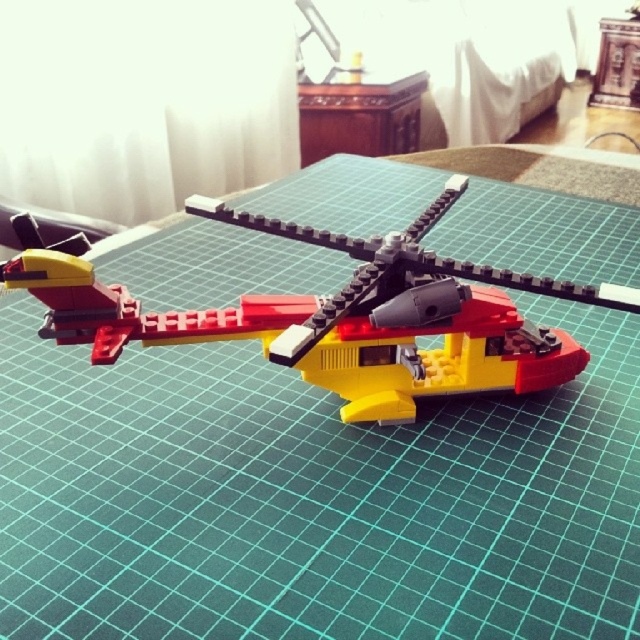
Is point (528, 321) positioned behind point (337, 138)?

No, it is in front of (337, 138).

What do you see at coordinates (337, 314) in the screenshot? I see `yellow plastic helicopter at center` at bounding box center [337, 314].

Which is in front, point (221, 332) or point (401, 113)?

Point (221, 332) is in front.

Locate an element on the screen. yellow plastic helicopter at center is located at coordinates (337, 314).